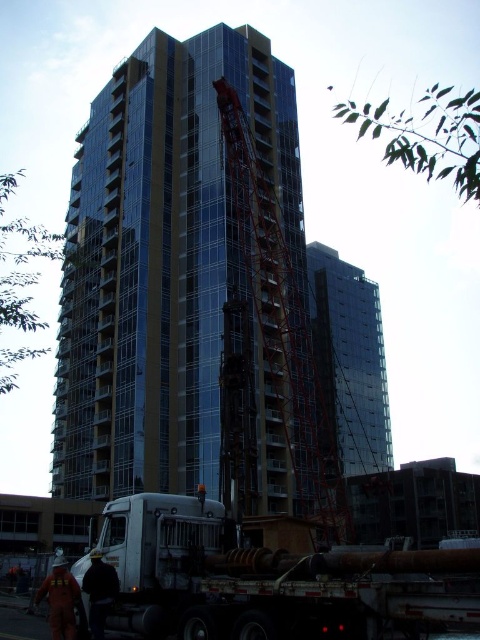
You are an inspector who needs to assess the safety of the reddish metallic crane at center and the orange reflective suit at lower left. Which object is bigger in size?

The reddish metallic crane at center has a larger size compared to the orange reflective suit at lower left, so the crane is bigger.

You are a delivery driver who needs to back your truck into the construction site. The truck is 2.5 meters wide. The site has a narrow path leading to the loading area. The path is flanked by the reddish metallic crane at center and the dark gray fabric jacket at lower left. Can your truck safely pass through the path without hitting either object?

The reddish metallic crane at center might be wider than dark gray fabric jacket at lower left. Since the path is flanked by both objects, and the crane could be wider, there is uncertainty about the available space. The truck driver should exercise caution or consult site plans to ensure safe passage.

You are a safety inspector standing at the construction site. You notice the glassy steel building at center and the orange reflective suit at lower left. Which object is bigger in size?

The glassy steel building at center is larger in size compared to the orange reflective suit at lower left.